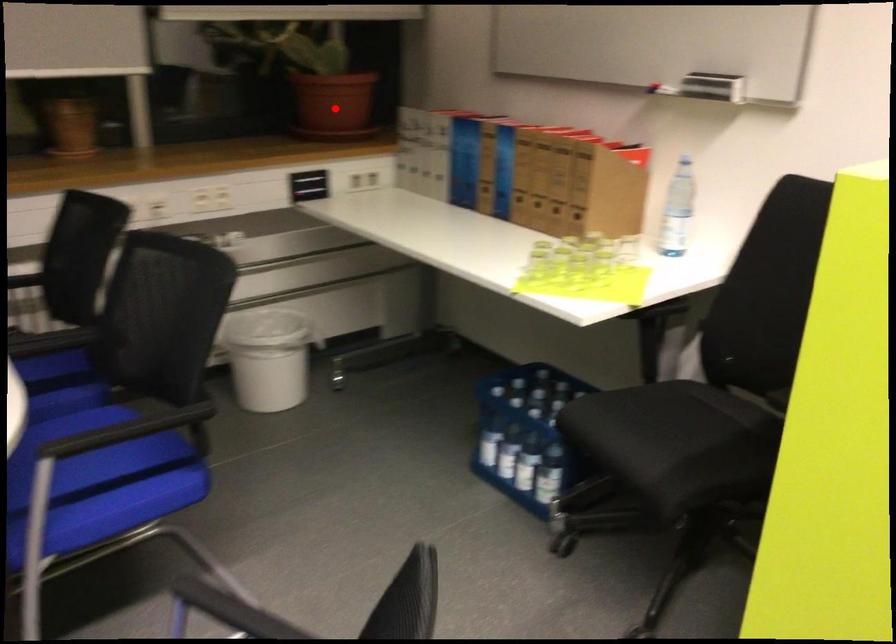
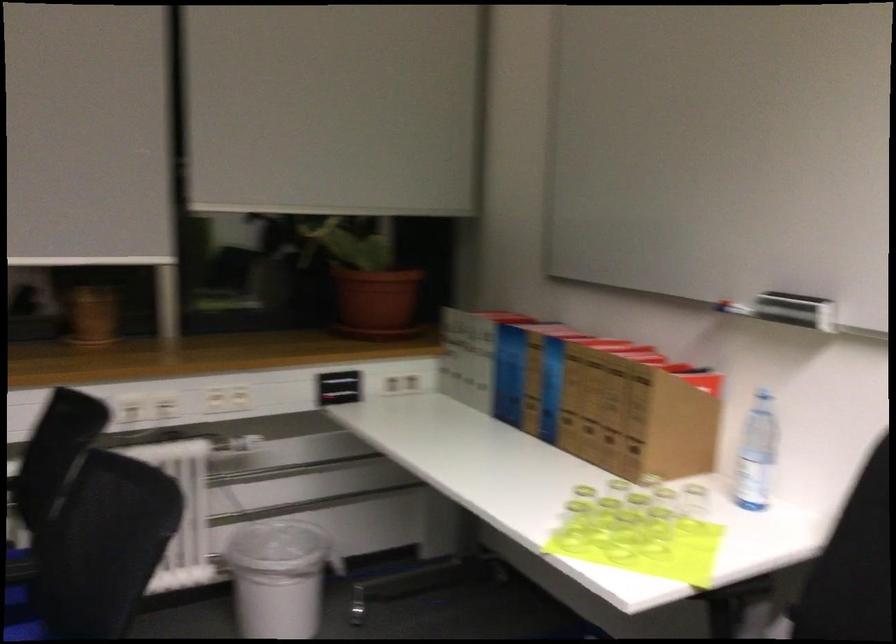
Where in the second image is the point corresponding to the highlighted location from the first image?

(375, 303)